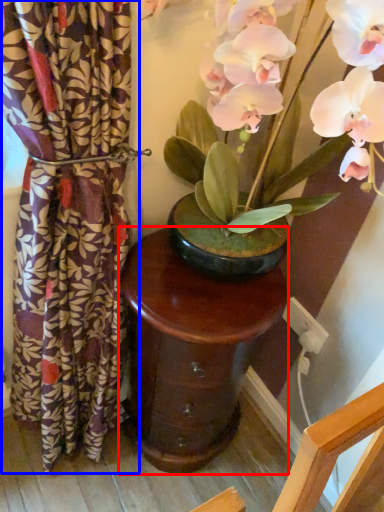
Question: Which object is further to the camera taking this photo, table (highlighted by a red box) or curtain (highlighted by a blue box)?

Choices:
 (A) table
 (B) curtain

Answer: (A)